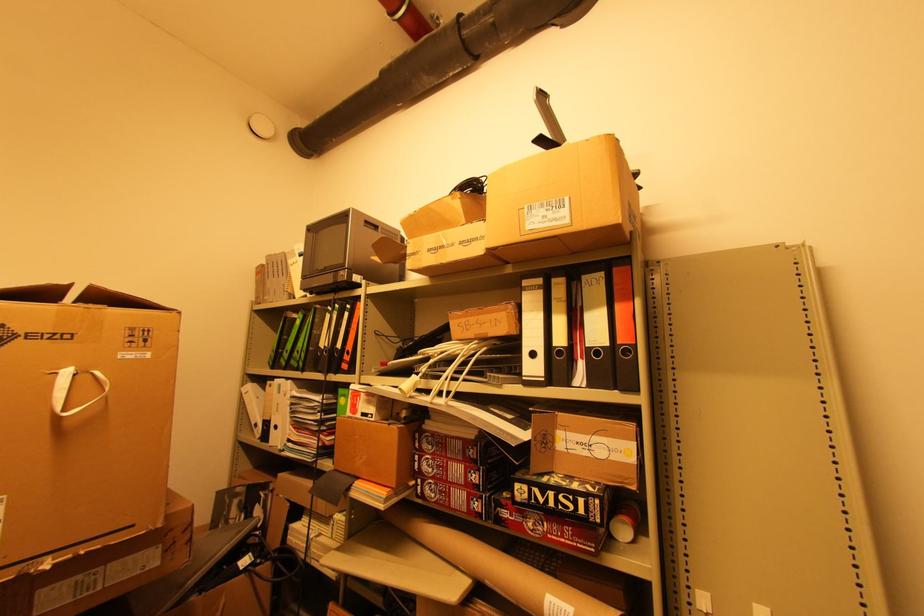
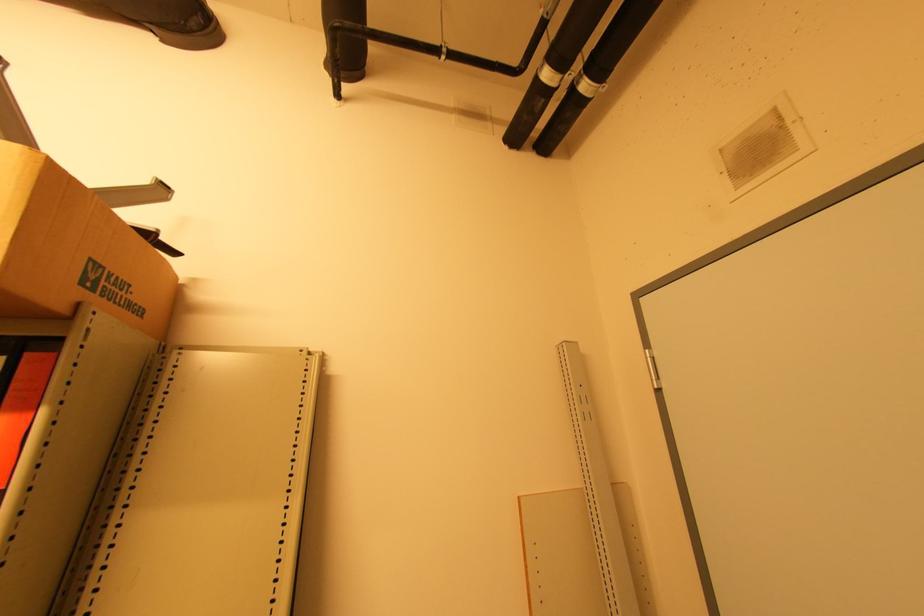
Locate, in the second image, the point that corresponds to (x=634, y=223) in the first image.

(95, 290)